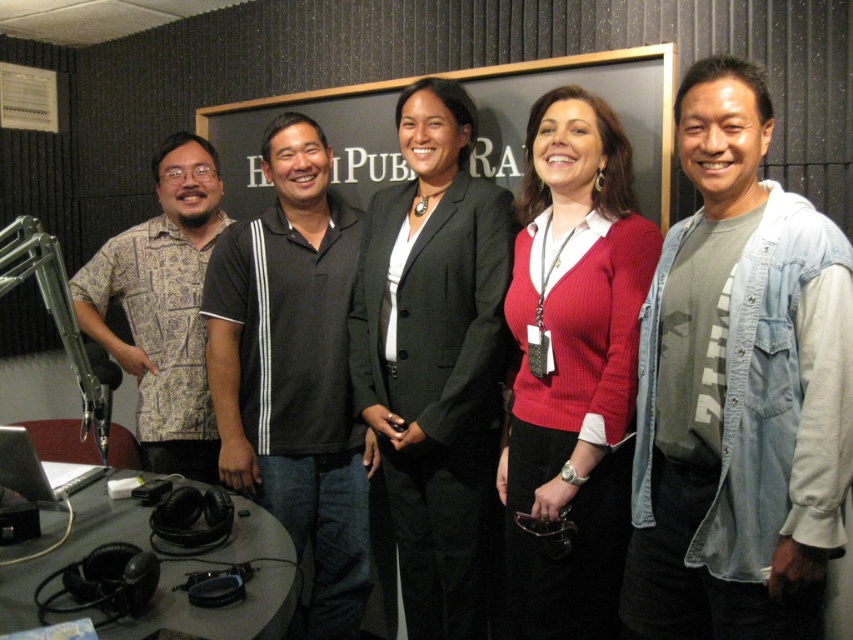
Who is more distant from viewer, (x=759, y=244) or (x=386, y=380)?

Positioned behind is point (x=386, y=380).

Where is `denim jacket at right`? This screenshot has width=853, height=640. denim jacket at right is located at coordinates (x=740, y=388).

Measure the distance between ribbed sweater at center and patterned fabric shirt at left.

ribbed sweater at center and patterned fabric shirt at left are 3.78 feet apart from each other.

Does ribbed sweater at center appear over patterned fabric shirt at left?

No, ribbed sweater at center is not above patterned fabric shirt at left.

Locate an element on the screen. Image resolution: width=853 pixels, height=640 pixels. ribbed sweater at center is located at coordinates 572,365.

Image resolution: width=853 pixels, height=640 pixels. Find the location of `ribbed sweater at center`. ribbed sweater at center is located at coordinates (572, 365).

Does matte black blazer at center have a lesser height compared to black polo shirt at center?

No.

I want to click on matte black blazer at center, so click(434, 358).

Find the location of a particular element. Image resolution: width=853 pixels, height=640 pixels. matte black blazer at center is located at coordinates (434, 358).